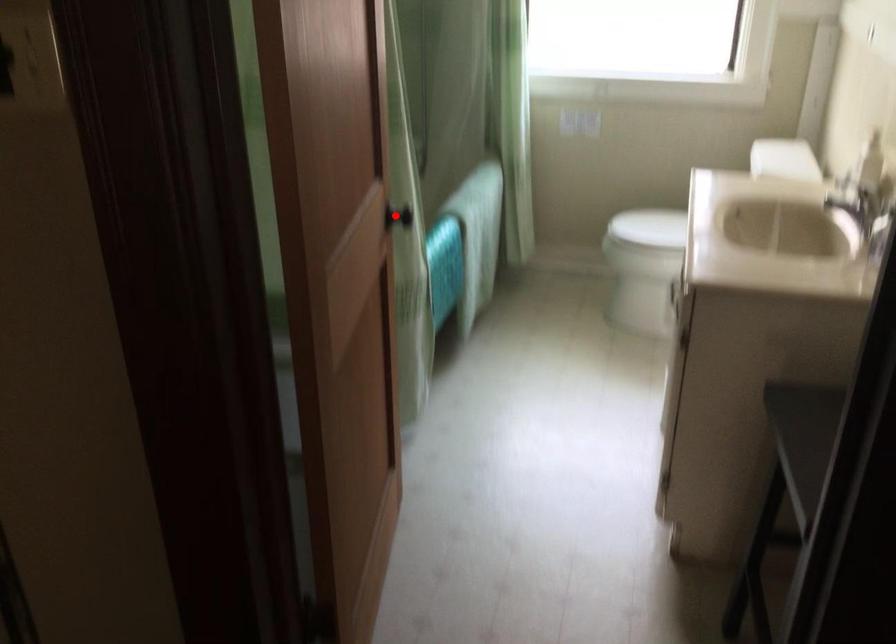
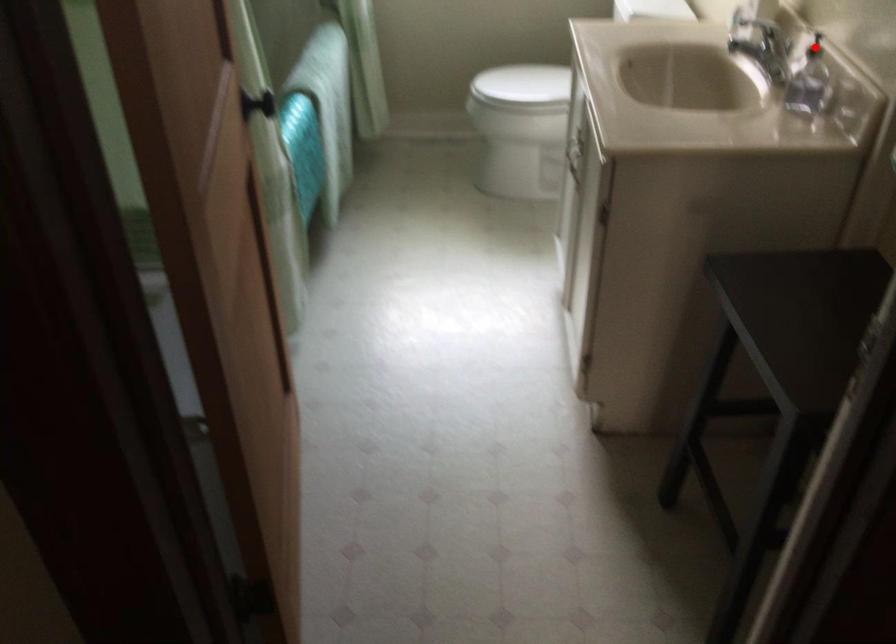
I am providing you with two images of the same scene from different viewpoints. A red point is marked on the first image and another point is marked on the second image. Does the point marked in image1 correspond to the same location as the one in image2?

No